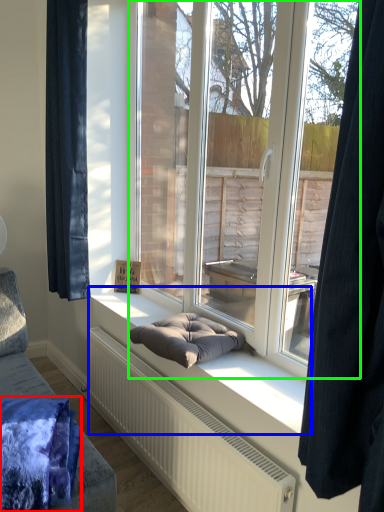
Question: Based on their relative distances, which object is nearer to blanket (highlighted by a red box)? Choose from window sill (highlighted by a blue box) and window (highlighted by a green box).

Choices:
 (A) window sill
 (B) window

Answer: (A)